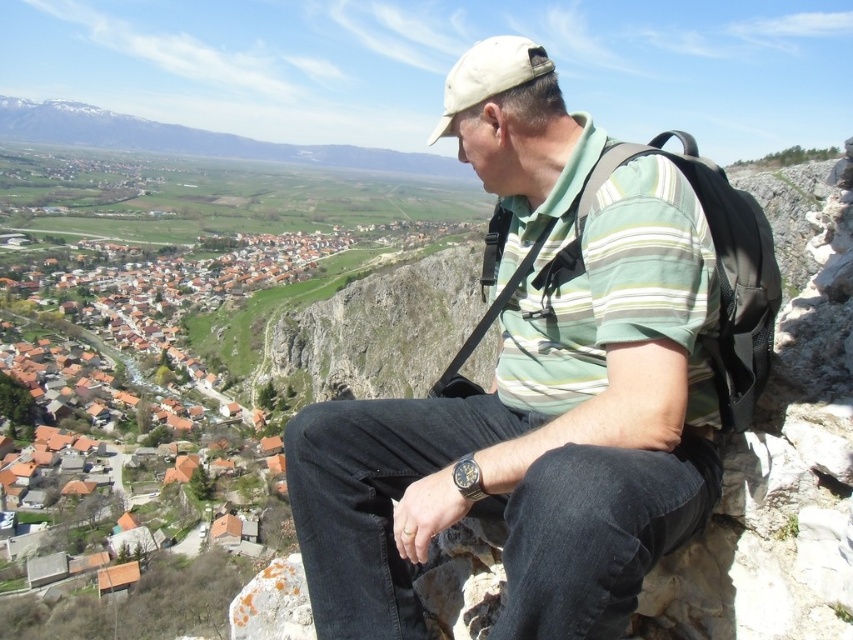
Which is more to the right, matte green striped shirt at center or black fabric backpack at center?

black fabric backpack at center

Is point (659, 257) positioned behind point (778, 272)?

No, it is in front of (778, 272).

Who is more distant from viewer, (509, 381) or (753, 340)?

Positioned behind is point (509, 381).

Find the location of `matte green striped shirt at center`. matte green striped shirt at center is located at coordinates (x=532, y=392).